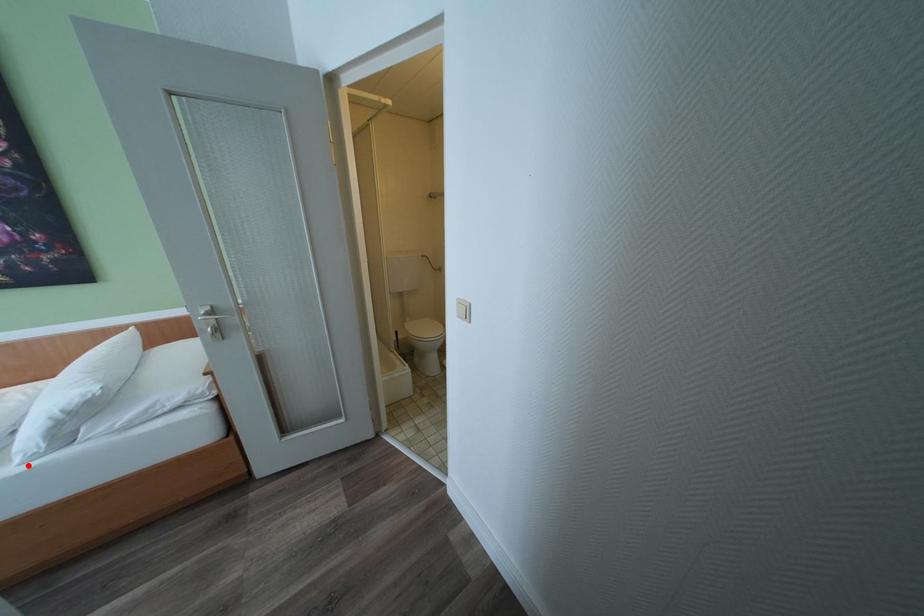
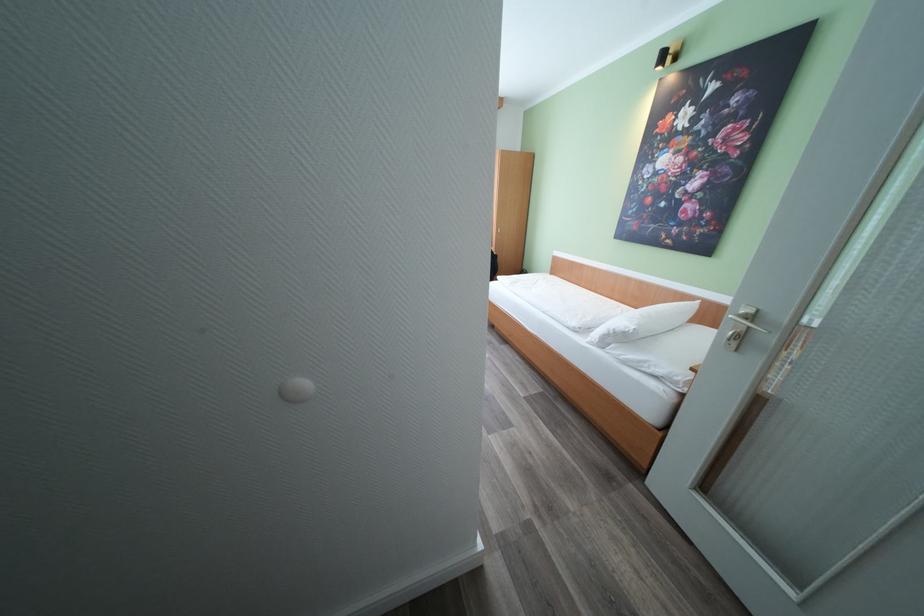
In the second image, find the point that corresponds to the highlighted location in the first image.

(593, 344)